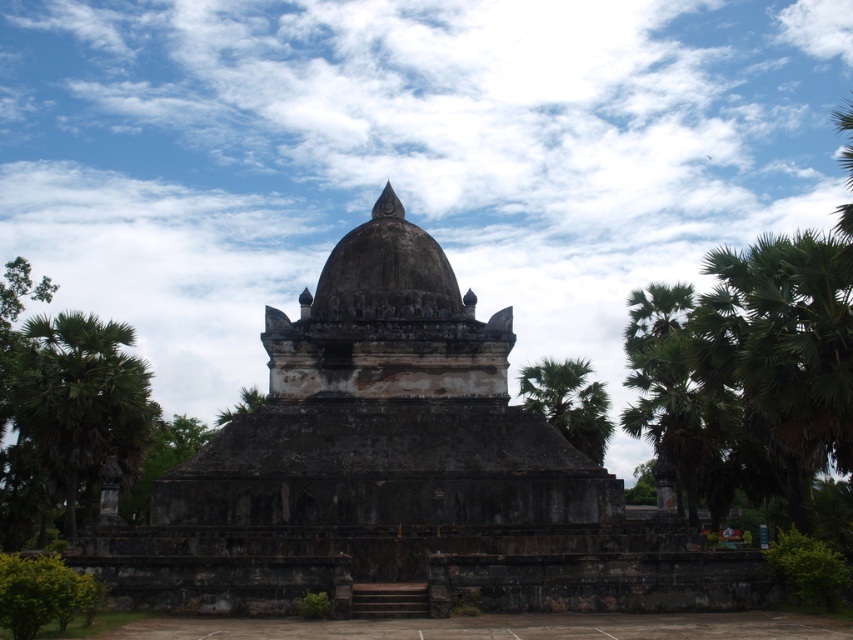
You are a tour guide planning a walking tour around the dark stone temple at center and the green leafy palm tree at left. The path between them is 72.38 feet. If your group walks at a steady pace of 3 feet per second, how many seconds will it take them to walk from the temple to the palm tree?

The distance between the dark stone temple at center and the green leafy palm tree at left is 72.38 feet. At a pace of 3 feet per second, the time required is 72.38 divided by 3, which equals approximately 24.13 seconds.

You are an architect visiting the ancient stone structure. You need to determine which object is wider between the dark stone temple at center and the green leafy palm tree at right. Based on the scene, which one is wider?

The dark stone temple at center is wider than the green leafy palm tree at right according to the description.

You are standing at the base of the ancient stone monument and notice two points marked on the ground. The first point is at coordinates point (527, 518), and the second point is at point (521, 372). Which point is closer to you?

Point (527, 518) is in front of point (521, 372), so it is closer to you.